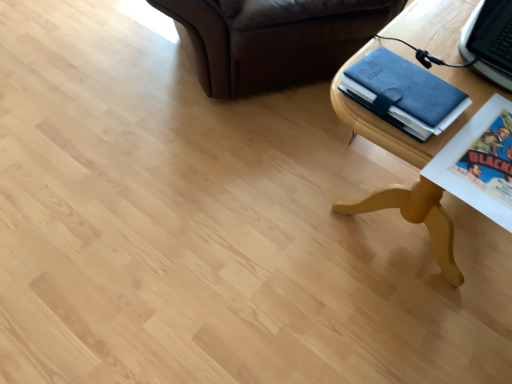
At what (x,y) coordinates should I click in order to perform the action: click on vacant space in front of blue leather binder at upper right. Please return your answer as a coordinate pair (x, y). This screenshot has width=512, height=384. Looking at the image, I should click on (441, 155).